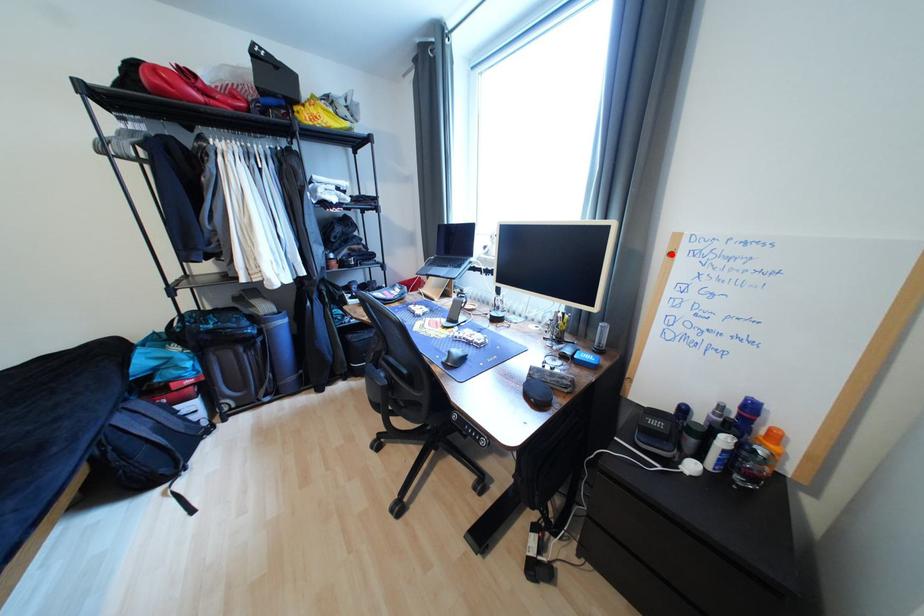
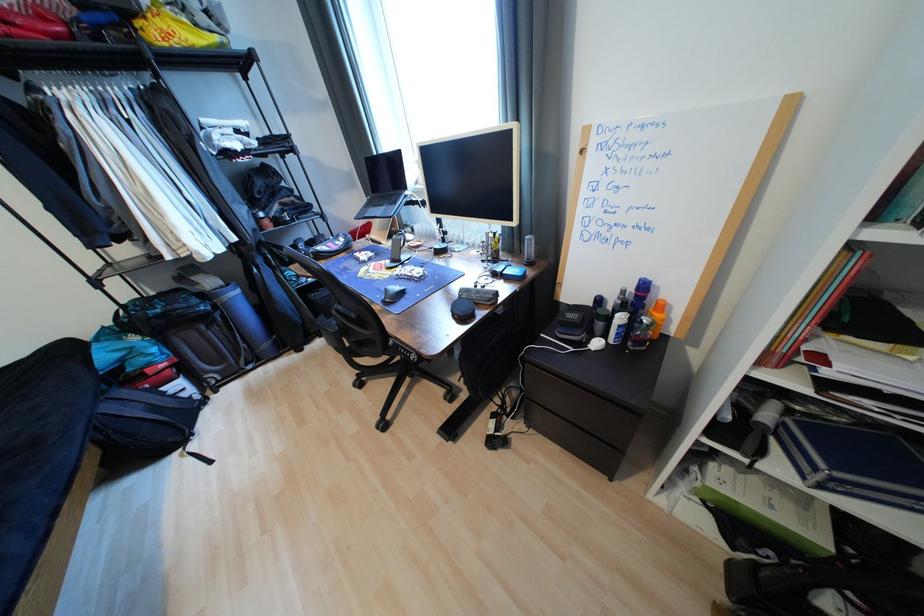
Locate, in the second image, the point that corresponds to the highlighted location in the first image.

(585, 153)